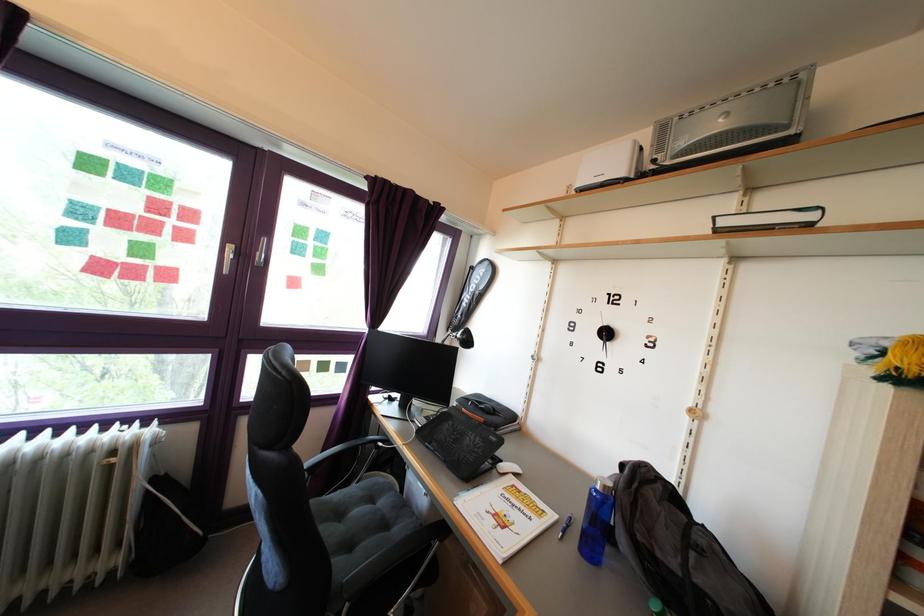
Identify the location of spiral notebook. (459, 442).